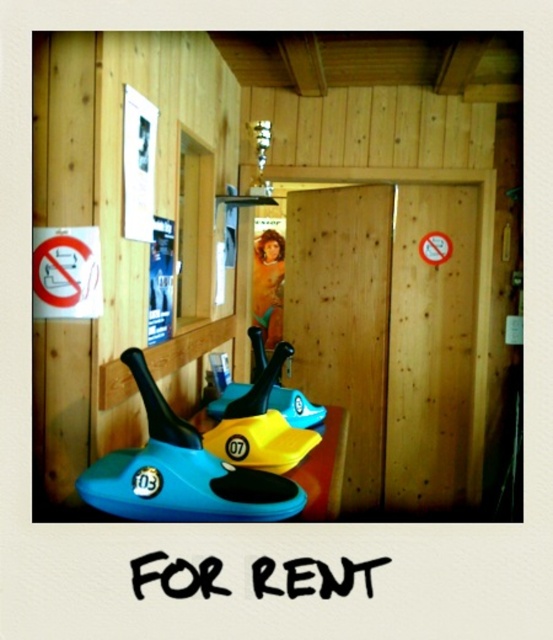
Is blue plastic snowboard at lower left smaller than blue rubber toy at center?

Incorrect, blue plastic snowboard at lower left is not smaller in size than blue rubber toy at center.

Where is `blue plastic snowboard at lower left`? blue plastic snowboard at lower left is located at coordinates (289, 259).

Identify the location of blue plastic snowboard at lower left. (289, 259).

Where is `blue plastic snowboard at lower left`? blue plastic snowboard at lower left is located at coordinates (289, 259).